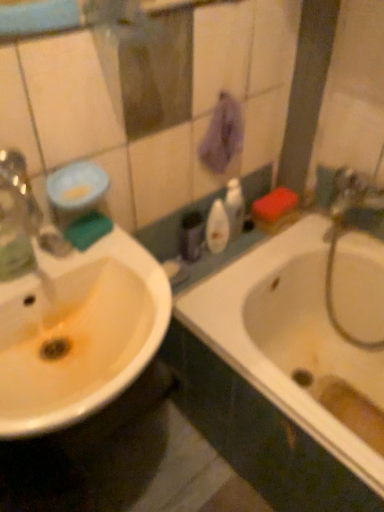
Question: Does white glossy bathtub at right have a lesser height compared to green sponge at left, positioned as the 2th mouthwash in right-to-left order?

Choices:
 (A) yes
 (B) no

Answer: (B)

Question: Considering the relative sizes of white glossy bathtub at right and green sponge at left, placed as the first mouthwash when sorted from left to right, in the image provided, is white glossy bathtub at right taller than green sponge at left, placed as the first mouthwash when sorted from left to right,?

Choices:
 (A) yes
 (B) no

Answer: (A)

Question: Can you confirm if white glossy bathtub at right is smaller than green sponge at left, positioned as the 2th mouthwash in right-to-left order?

Choices:
 (A) yes
 (B) no

Answer: (B)

Question: Can we say white glossy bathtub at right lies outside green sponge at left, acting as the 1th mouthwash starting from the front?

Choices:
 (A) no
 (B) yes

Answer: (B)

Question: Is the surface of white glossy bathtub at right in direct contact with green sponge at left, acting as the 1th mouthwash starting from the front?

Choices:
 (A) no
 (B) yes

Answer: (A)

Question: Is white glossy bathtub at right closer to the viewer compared to green sponge at left, placed as the first mouthwash when sorted from left to right?

Choices:
 (A) no
 (B) yes

Answer: (B)

Question: Does white glossy sink at left have a greater height compared to white glossy bottle at center, marked as the first toiletry in a right-to-left arrangement?

Choices:
 (A) no
 (B) yes

Answer: (A)

Question: Is white glossy sink at left facing towards white glossy bottle at center, the 2th toiletry from the left?

Choices:
 (A) yes
 (B) no

Answer: (B)

Question: Is white glossy sink at left closer to the viewer compared to white glossy bottle at center, the 2th toiletry from the left?

Choices:
 (A) yes
 (B) no

Answer: (A)

Question: Can you confirm if white glossy sink at left is positioned to the left of white glossy bottle at center, marked as the first toiletry in a right-to-left arrangement?

Choices:
 (A) no
 (B) yes

Answer: (B)

Question: Is white glossy sink at left with white glossy bottle at center, marked as the first toiletry in a right-to-left arrangement?

Choices:
 (A) yes
 (B) no

Answer: (B)

Question: Is white glossy sink at left not near white glossy bottle at center, marked as the first toiletry in a right-to-left arrangement?

Choices:
 (A) yes
 (B) no

Answer: (B)

Question: From the image's perspective, would you say white glossy sink at left is shown under green sponge at left?

Choices:
 (A) yes
 (B) no

Answer: (A)